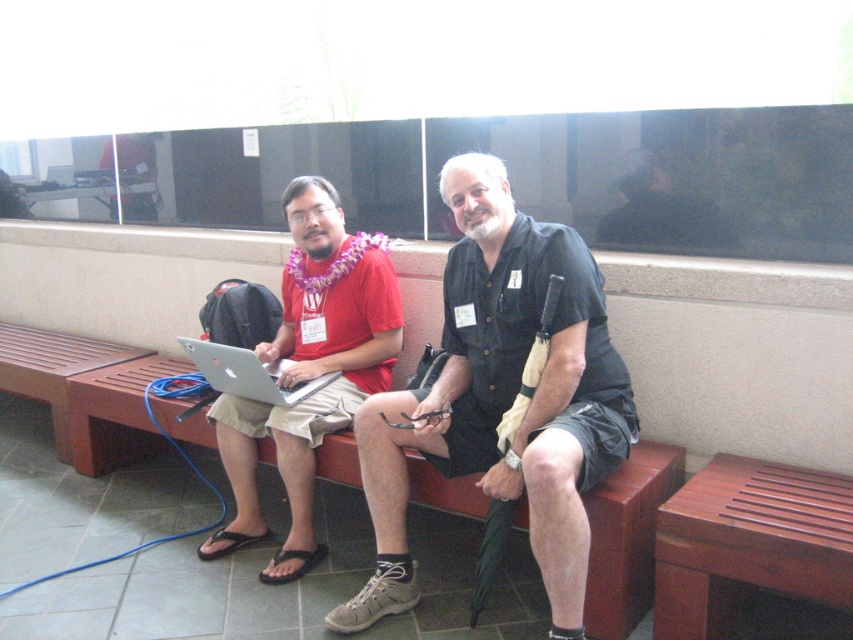
Question: Which of the following is the farthest from the observer?

Choices:
 (A) (264, 412)
 (B) (322, 374)

Answer: (B)

Question: Does brown wooden bench at lower right appear on the left side of silver metallic laptop at center?

Choices:
 (A) yes
 (B) no

Answer: (B)

Question: Which of the following is the closest to the observer?

Choices:
 (A) brown wooden bench at lower right
 (B) matte black laptop at left

Answer: (A)

Question: Can you confirm if matte black laptop at left is smaller than silver metallic laptop at center?

Choices:
 (A) no
 (B) yes

Answer: (A)

Question: Which is nearer to the brown wooden bench at lower left?

Choices:
 (A) brown wooden bench at lower right
 (B) silver metallic laptop at center
 (C) matte black shirt at center
 (D) brown wooden bench at center

Answer: (D)

Question: Is brown wooden bench at center bigger than silver metallic laptop at center?

Choices:
 (A) yes
 (B) no

Answer: (A)